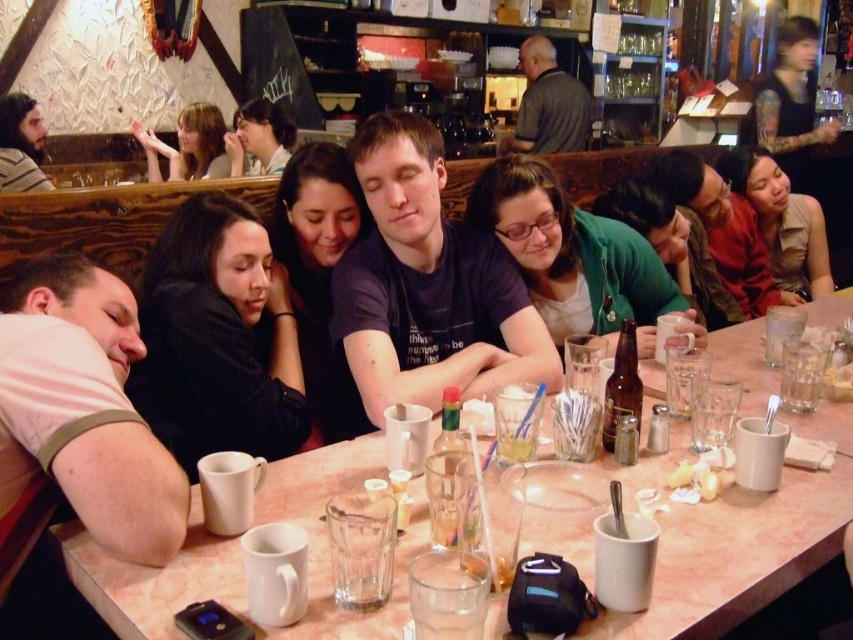
Question: Considering the relative positions of matte black hair at upper left and bearded man at left in the image provided, where is matte black hair at upper left located with respect to bearded man at left?

Choices:
 (A) right
 (B) left

Answer: (A)

Question: Is bearded man at left smaller than brown glass bottle at center?

Choices:
 (A) no
 (B) yes

Answer: (A)

Question: Among these objects, which one is farthest from the camera?

Choices:
 (A) bearded man at left
 (B) white ceramic mug at upper left
 (C) matte black shirt at center
 (D) brown leather jacket at upper right

Answer: (A)

Question: Which object appears closest to the camera in this image?

Choices:
 (A) white ceramic mug at upper left
 (B) bearded man at left
 (C) brown leather jacket at upper right

Answer: (A)

Question: Is matte black shirt at center bigger than brown leather jacket at upper right?

Choices:
 (A) no
 (B) yes

Answer: (B)

Question: Which of the following is the farthest from the observer?

Choices:
 (A) click(717, 168)
 (B) click(218, 244)

Answer: (A)